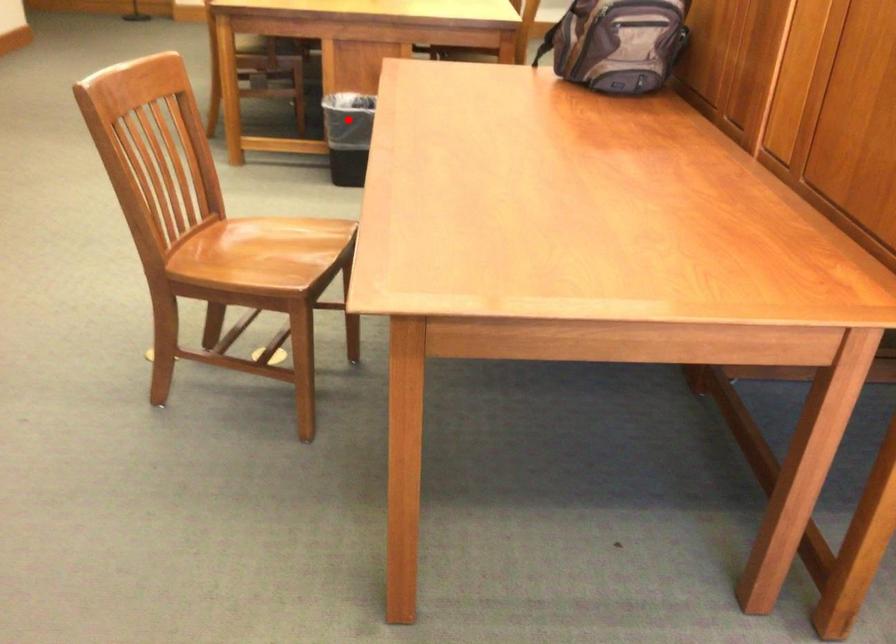
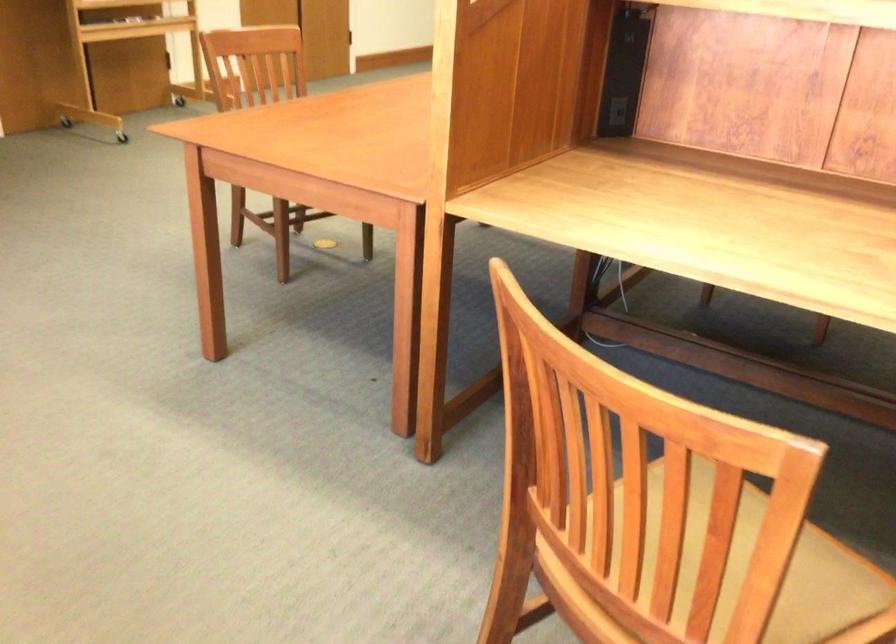
Question: I am providing you with two images of the same scene from different viewpoints. A red point is marked on the first image. Is the red point's position out of view in image 2?

Choices:
 (A) Yes
 (B) No

Answer: (A)